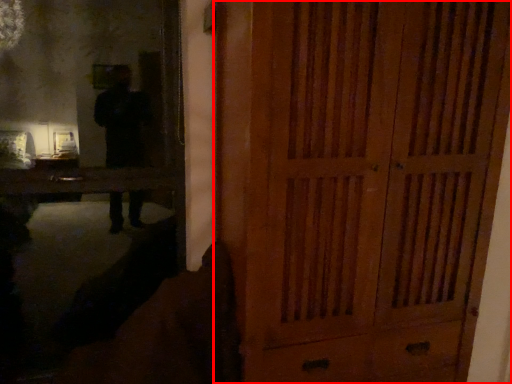
Question: In this image, where is door (annotated by the red box) located relative to mirror?

Choices:
 (A) left
 (B) right

Answer: (B)